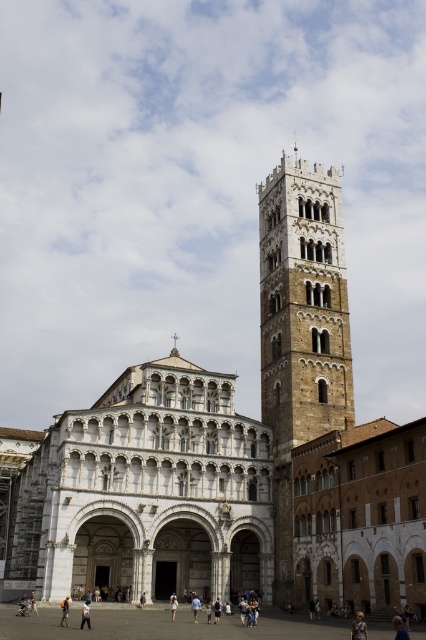
Is dark brown leather jacket at lower right positioned at the back of camouflage fabric person at center?

No.

Is dark brown leather jacket at lower right below camouflage fabric person at center?

No.

Between point (400, 632) and point (65, 621), which one is positioned in front?

Positioned in front is point (400, 632).

Where is `dark brown leather jacket at lower right`? dark brown leather jacket at lower right is located at coordinates (400, 628).

Is point (108, 483) positioned after point (26, 611)?

That is True.

Between white stone cathedral at center and light brown leather jacket at lower left, which one appears on the left side from the viewer's perspective?

light brown leather jacket at lower left

Is point (241, 516) positioned behind point (22, 616)?

Yes.

At what (x,y) coordinates should I click in order to perform the action: click on white stone cathedral at center. Please return your answer as a coordinate pair (x, y). The height and width of the screenshot is (640, 426). Looking at the image, I should click on click(x=141, y=492).

Is light brown leather jacket at lower center smaller than light brown leather bag at center?

Actually, light brown leather jacket at lower center might be larger than light brown leather bag at center.

Who is more distant from viewer, [88,621] or [31,605]?

The point [31,605] is more distant.

I want to click on light brown leather jacket at lower center, so click(86, 614).